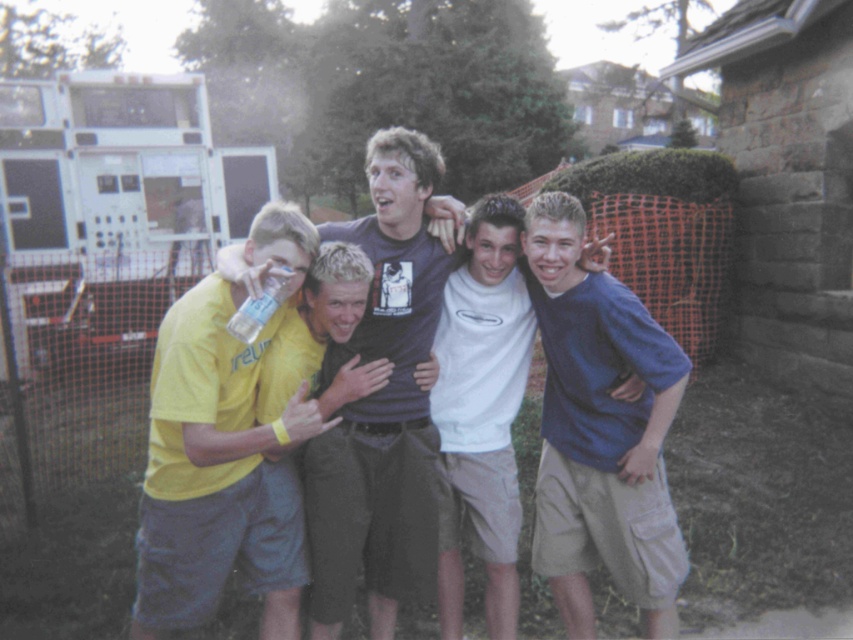
Between yellow matte t-shirt at left and blue cotton shirt at center, which one has less height?

yellow matte t-shirt at left

Who is more distant from viewer, (189, 586) or (570, 628)?

Positioned behind is point (570, 628).

You are a GUI agent. You are given a task and a screenshot of the screen. Output one action in this format:
    pyautogui.click(x=<x>, y=<y>)
    Task: Click on the yellow matte t-shirt at left
    
    Given the screenshot: What is the action you would take?
    216,476

Is yellow matte t-shirt at left positioned behind white cotton t-shirt at center?

No, it is in front of white cotton t-shirt at center.

Who is positioned more to the right, yellow matte t-shirt at left or white cotton t-shirt at center?

→ From the viewer's perspective, white cotton t-shirt at center appears more on the right side.

Where is `yellow matte t-shirt at left`? yellow matte t-shirt at left is located at coordinates (216, 476).

Identify the location of yellow matte t-shirt at left. The image size is (853, 640). (216, 476).

Measure the distance between dark blue t-shirt at center and camera.

dark blue t-shirt at center and camera are 9.23 feet apart.

Which is below, dark blue t-shirt at center or white cotton t-shirt at center?

white cotton t-shirt at center is below.

Is point (393, 394) less distant than point (519, 518)?

Yes, point (393, 394) is closer to viewer.

Identify the location of dark blue t-shirt at center. (381, 403).